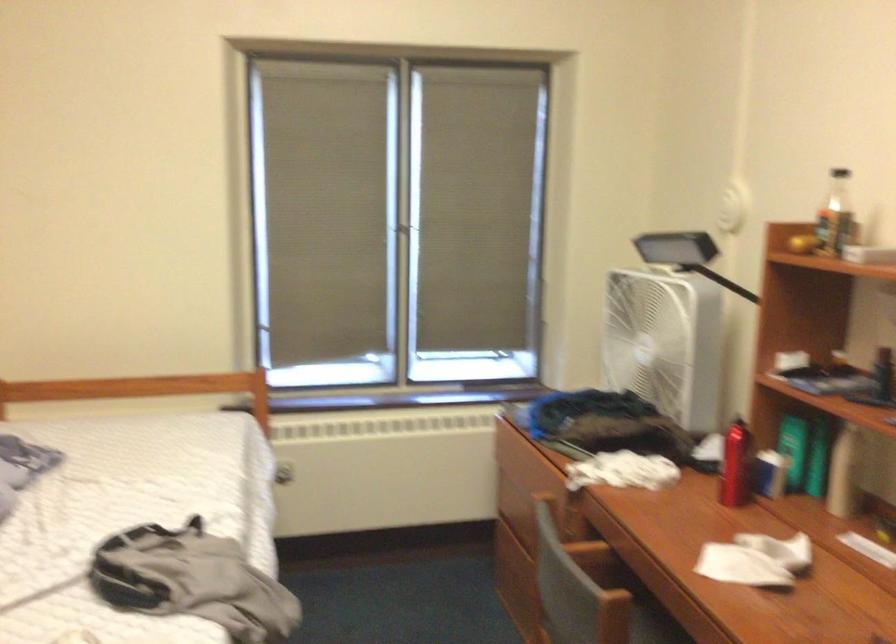
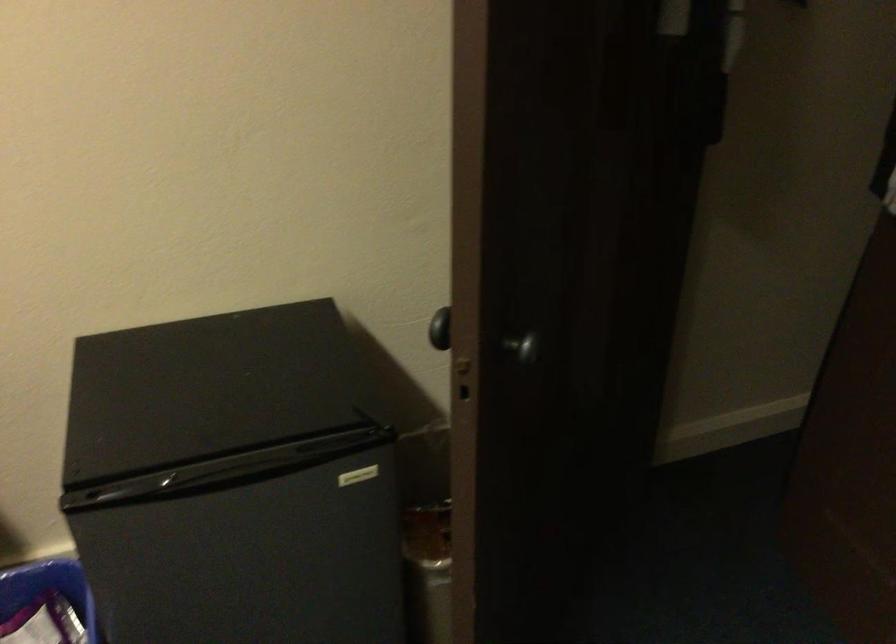
First-person continuous shooting, in which direction is the camera rotating?

The rotation direction of the camera is right-down.